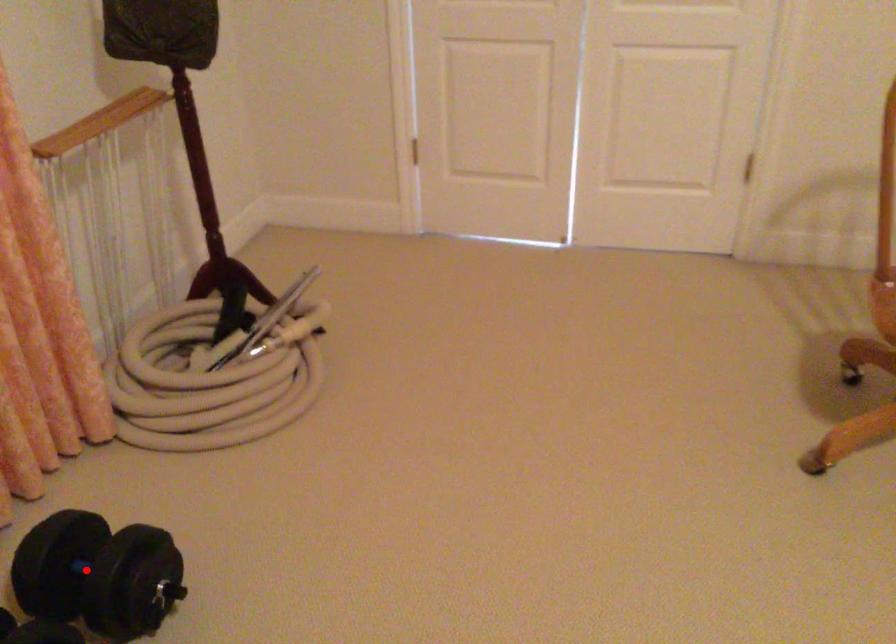
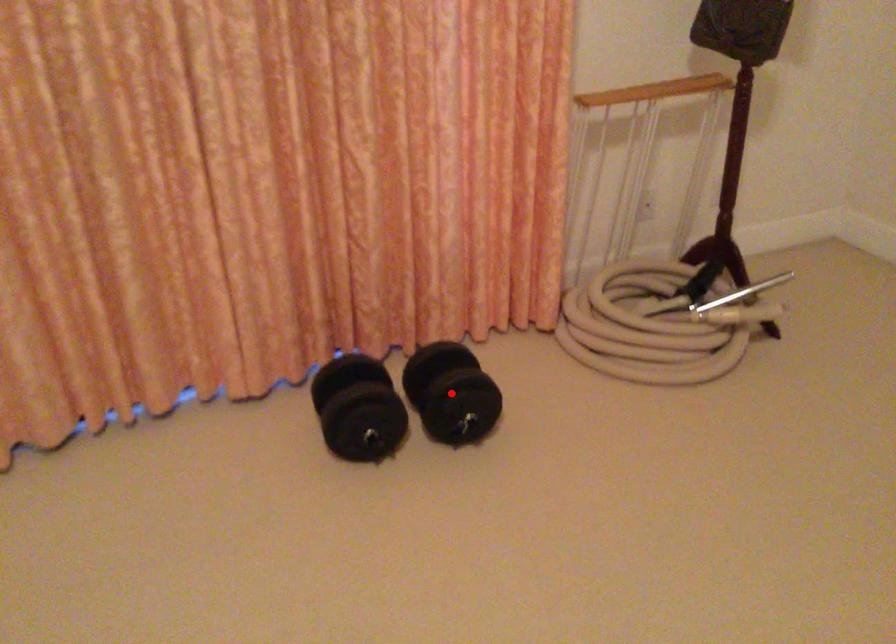
I am providing you with two images of the same scene from different viewpoints. A red point is marked on the first image and another point is marked on the second image. Do the highlighted points in image1 and image2 indicate the same real-world spot?

Yes